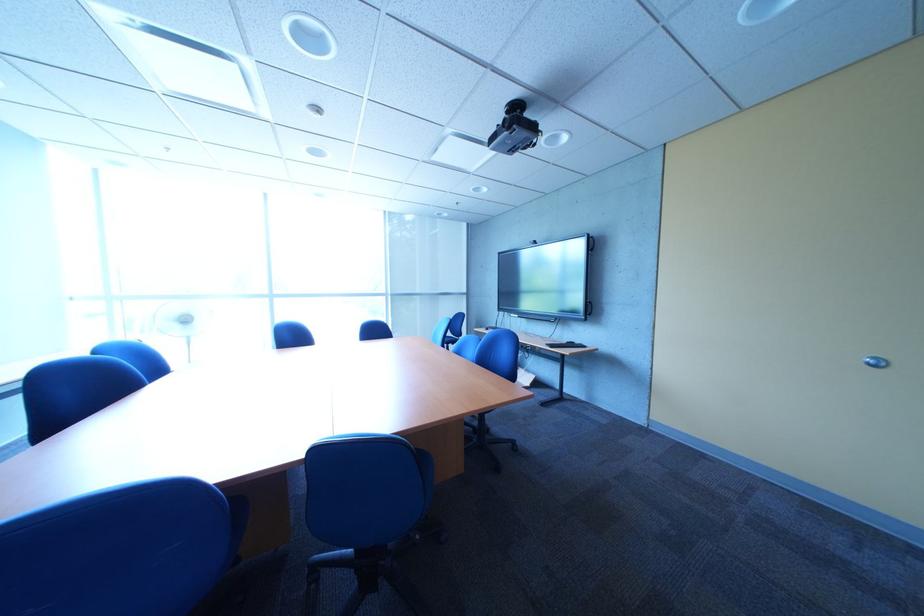
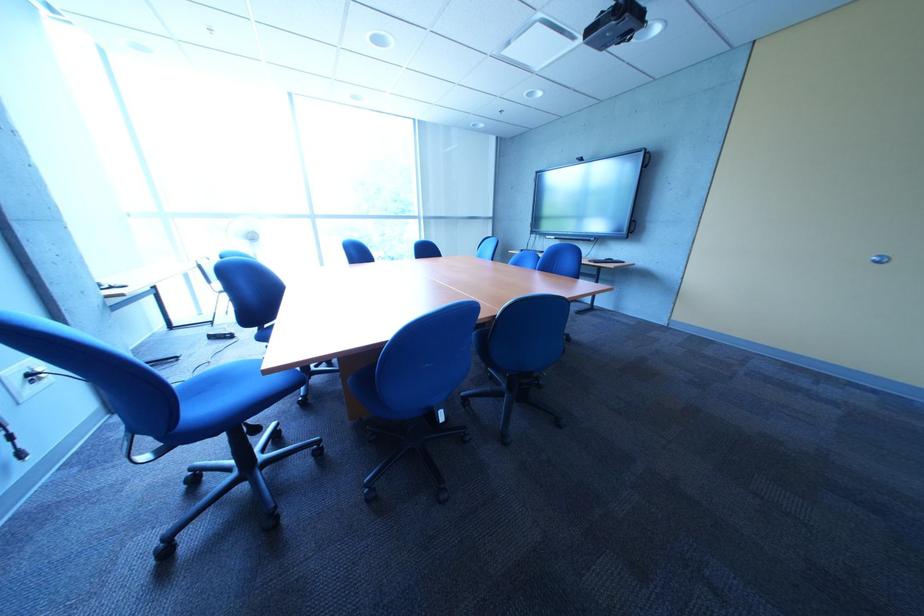
Looking at this image, which direction would the cameraman need to move to produce the second image?

The cameraman walked toward left, backward.